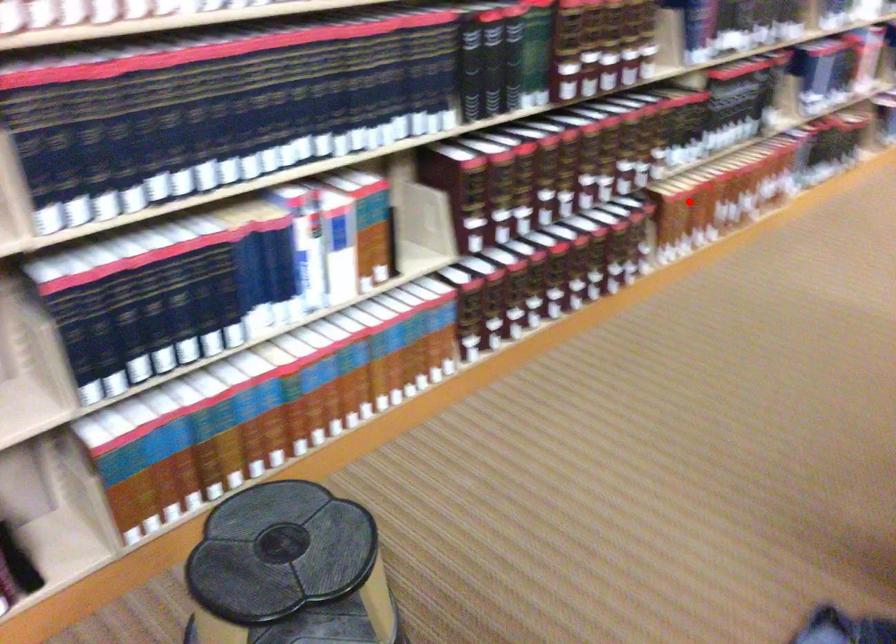
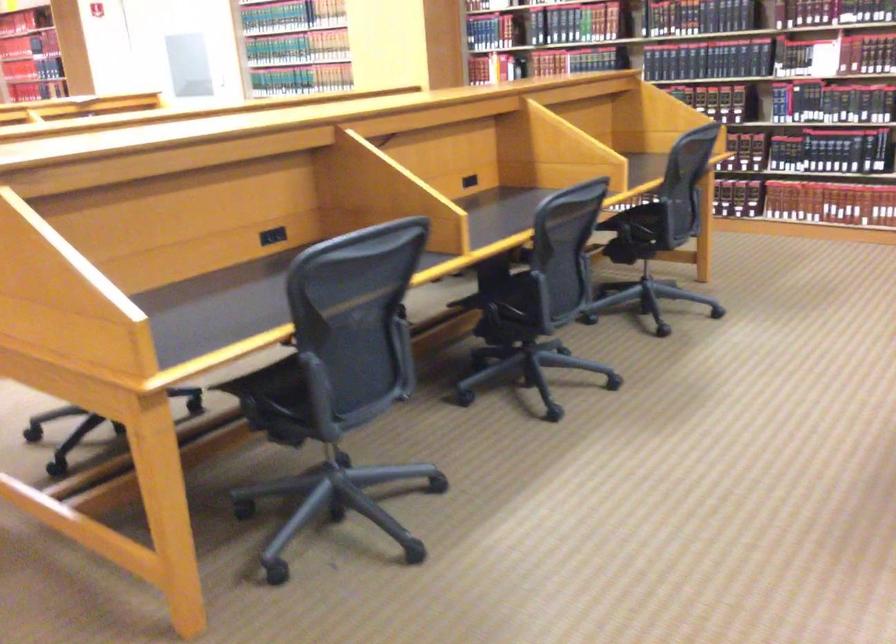
Where in the second image is the point corresponding to the highlighted location from the first image?

(734, 173)